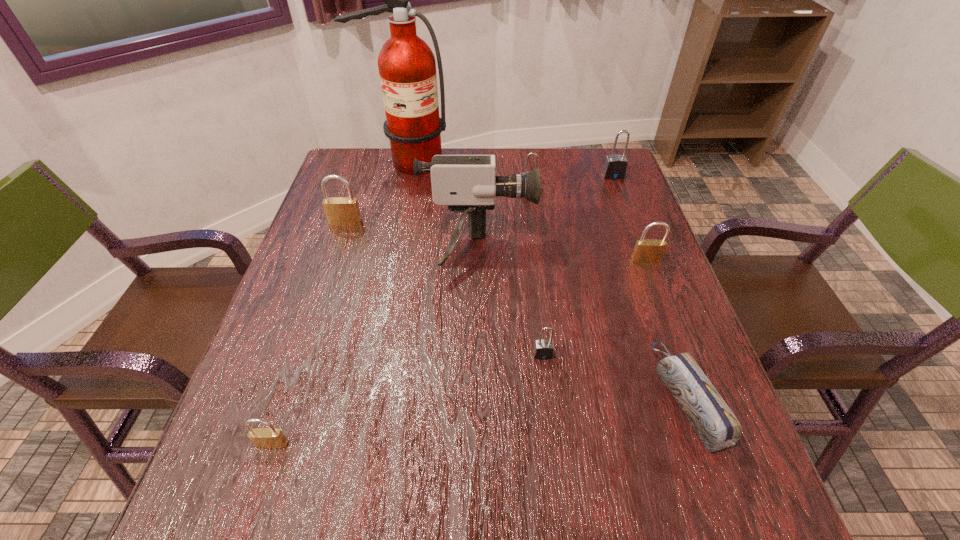
Find the location of a particular element. The image size is (960, 540). gray padlock that is the second nearest to the third farthest padlock is located at coordinates (543, 349).

Identify which gray padlock is located as the second nearest to the biggest brass padlock. Please provide its 2D coordinates. Your answer should be formatted as a tuple, i.e. [(x, y)], where the tuple contains the x and y coordinates of a point satisfying the conditions above.

[(543, 349)]

Locate which brass padlock ranks in proximity to the biggest brass padlock. Please provide its 2D coordinates. Your answer should be formatted as a tuple, i.e. [(x, y)], where the tuple contains the x and y coordinates of a point satisfying the conditions above.

[(267, 438)]

At what (x,y) coordinates should I click in order to perform the action: click on brass padlock that can be found as the second closest to the tallest object. Please return your answer as a coordinate pair (x, y). Image resolution: width=960 pixels, height=540 pixels. Looking at the image, I should click on (646, 250).